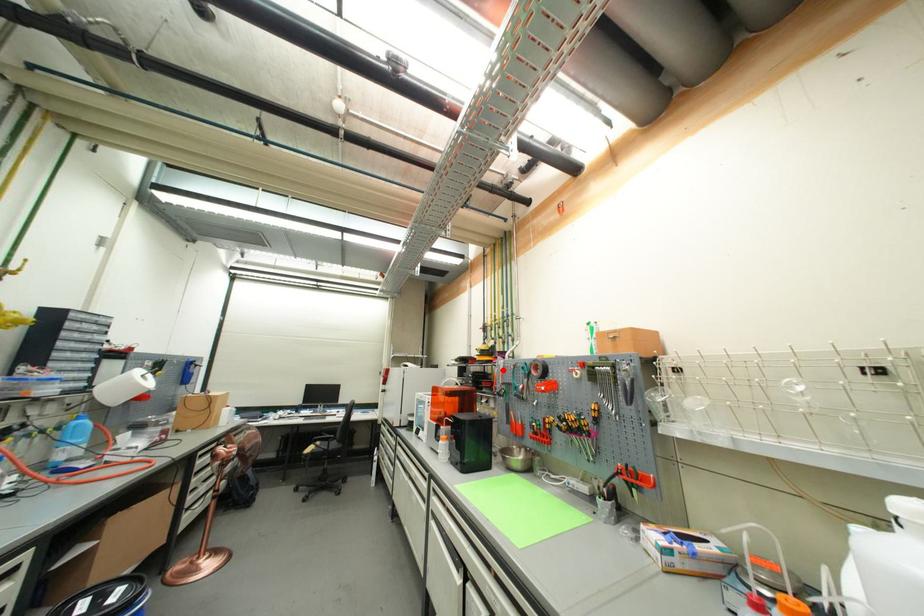
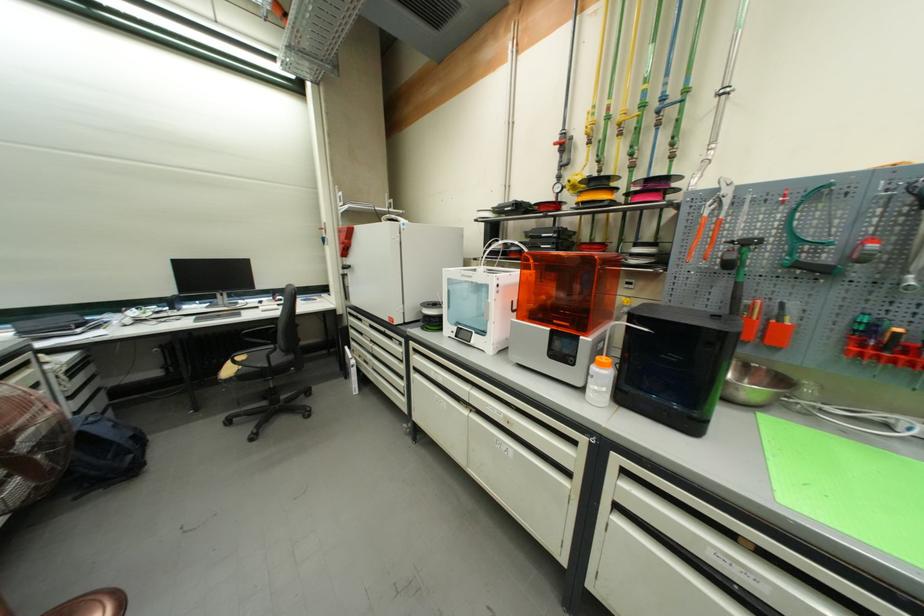
Find the pixel in the second image that matches the highlighted location in the first image.

(719, 208)